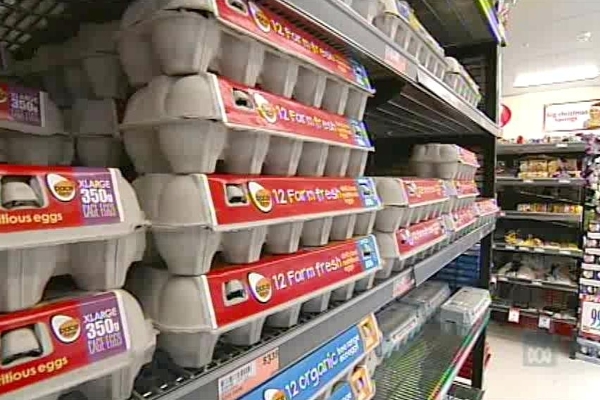
Find the location of a particular element. The width and height of the screenshot is (600, 400). flooring is located at coordinates (513, 384).